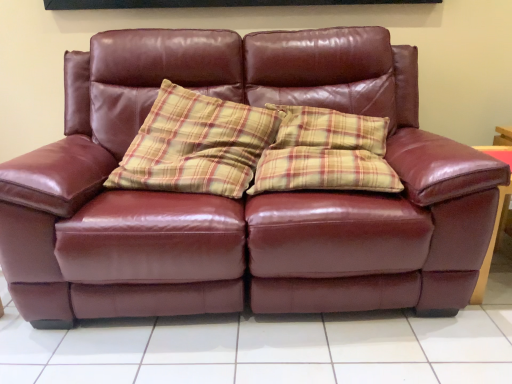
Question: Should I look upward or downward to see brown leather couch at center?

Choices:
 (A) down
 (B) up

Answer: (A)